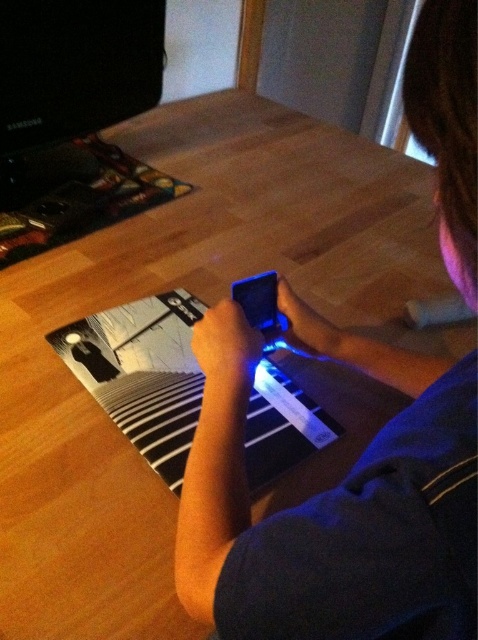
Question: Which point appears closest to the camera in this image?

Choices:
 (A) (388, 529)
 (B) (162, 300)

Answer: (A)

Question: Is blue matte phone at center bigger than black glossy magazine at center?

Choices:
 (A) yes
 (B) no

Answer: (A)

Question: Considering the relative positions of blue matte phone at center and black glossy magazine at center in the image provided, where is blue matte phone at center located with respect to black glossy magazine at center?

Choices:
 (A) below
 (B) above

Answer: (A)

Question: From the image, what is the correct spatial relationship of blue matte phone at center in relation to black glossy magazine at center?

Choices:
 (A) below
 (B) above

Answer: (A)